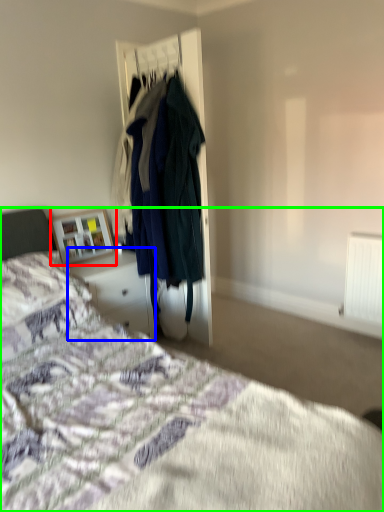
Question: Estimate the real-world distances between objects in this image. Which object is farther from picture frame (highlighted by a red box), vanity (highlighted by a blue box) or bed (highlighted by a green box)?

Choices:
 (A) vanity
 (B) bed

Answer: (B)